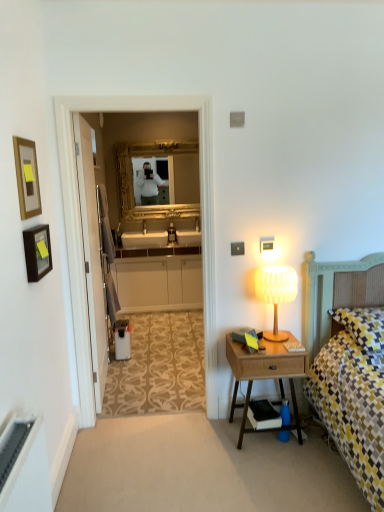
Question: From a real-world perspective, is white ribbed glass table lamp at right positioned under white matte cabinet at center based on gravity?

Choices:
 (A) no
 (B) yes

Answer: (A)

Question: Is white ribbed glass table lamp at right smaller than white matte cabinet at center?

Choices:
 (A) yes
 (B) no

Answer: (A)

Question: Is white ribbed glass table lamp at right taller than white matte cabinet at center?

Choices:
 (A) no
 (B) yes

Answer: (A)

Question: Is white ribbed glass table lamp at right to the left of white matte cabinet at center from the viewer's perspective?

Choices:
 (A) no
 (B) yes

Answer: (A)

Question: Considering the relative sizes of white ribbed glass table lamp at right and white matte cabinet at center in the image provided, is white ribbed glass table lamp at right shorter than white matte cabinet at center?

Choices:
 (A) yes
 (B) no

Answer: (A)

Question: Does point (283, 291) appear closer or farther from the camera than point (372, 340)?

Choices:
 (A) closer
 (B) farther

Answer: (B)

Question: In the image, is white ribbed glass table lamp at right positioned in front of or behind yellow checkered pillow at right?

Choices:
 (A) front
 (B) behind

Answer: (B)

Question: In terms of size, does white ribbed glass table lamp at right appear bigger or smaller than yellow checkered pillow at right?

Choices:
 (A) big
 (B) small

Answer: (B)

Question: From the image's perspective, is white ribbed glass table lamp at right above or below yellow checkered pillow at right?

Choices:
 (A) above
 (B) below

Answer: (A)

Question: In terms of height, does white matte cabinet at center look taller or shorter compared to wooden picture frame at left, the 1th picture frame positioned from the bottom?

Choices:
 (A) short
 (B) tall

Answer: (B)

Question: From the image's perspective, relative to wooden picture frame at left, which is the 2th picture frame from top to bottom, is white matte cabinet at center above or below?

Choices:
 (A) above
 (B) below

Answer: (B)

Question: Considering the positions of white matte cabinet at center and wooden picture frame at left, the 1th picture frame positioned from the bottom, in the image, is white matte cabinet at center bigger or smaller than wooden picture frame at left, the 1th picture frame positioned from the bottom,?

Choices:
 (A) big
 (B) small

Answer: (A)

Question: Considering the positions of white matte cabinet at center and wooden picture frame at left, which is the 2th picture frame from top to bottom, in the image, is white matte cabinet at center wider or thinner than wooden picture frame at left, which is the 2th picture frame from top to bottom,?

Choices:
 (A) thin
 (B) wide

Answer: (B)

Question: Is point coord(23,141) positioned closer to the camera than point coord(284,339)?

Choices:
 (A) closer
 (B) farther

Answer: (A)

Question: From a real-world perspective, relative to white ribbed glass table lamp at right, is gold-framed picture at left, which is the 2th picture frame from bottom to top, vertically above or below?

Choices:
 (A) above
 (B) below

Answer: (A)